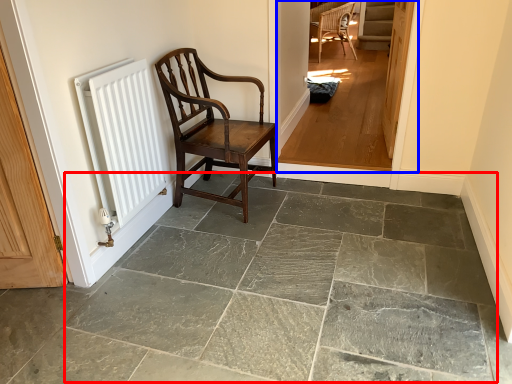
Question: Among these objects, which one is nearest to the camera, limestone (highlighted by a red box) or corridor (highlighted by a blue box)?

Choices:
 (A) limestone
 (B) corridor

Answer: (A)